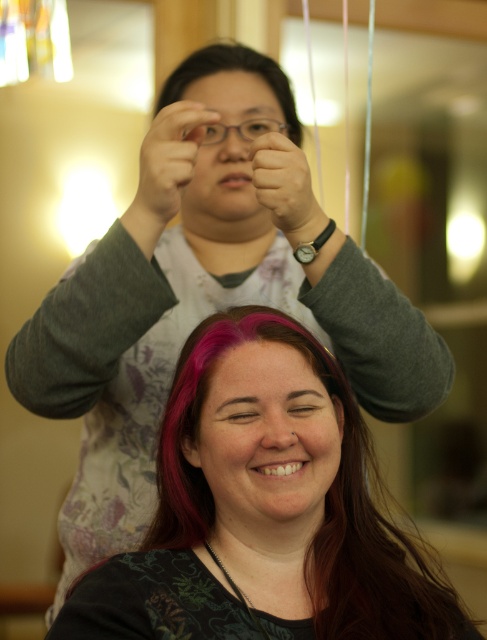
You are a stylist in a salon and need to decide which object to adjust first based on their sizes. Which object has a greater width between the matte gray hand at center and the matte black eye at upper center?

The matte gray hand at center has a greater width than the matte black eye at upper center according to the description.

You are a customer in a salon and see the matte gray hand at upper center and the matte black eye at center. Which object is positioned to the left side of the other?

The matte gray hand at upper center is to the left of the matte black eye at center.

You are an interior designer analyzing the layout of this salon. You notice the matte gray hand at upper center in the image. Can you determine its exact position using the coordinate system provided?

The matte gray hand at upper center is located at point coordinates [167,166].